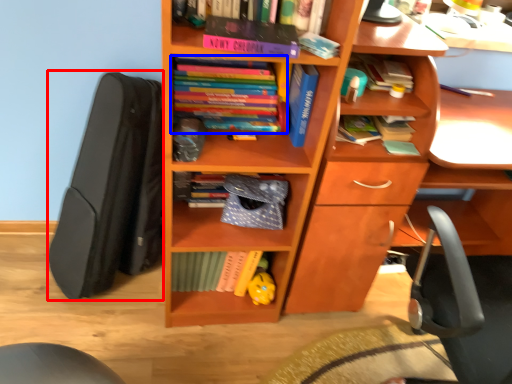
Question: Which of the following is the farthest to the observer, open (highlighted by a red box) or book (highlighted by a blue box)?

Choices:
 (A) open
 (B) book

Answer: (B)